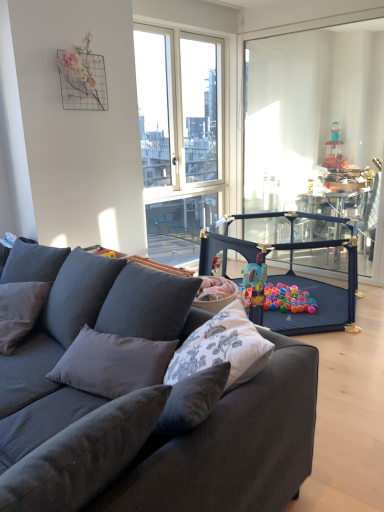
Question: Which is correct: dark gray fabric couch at center is inside transparent plastic playpen at right, or outside of it?

Choices:
 (A) inside
 (B) outside

Answer: (B)

Question: Is dark gray fabric couch at center bigger or smaller than transparent plastic playpen at right?

Choices:
 (A) small
 (B) big

Answer: (B)

Question: Which of these objects is positioned farthest from the dark gray fabric pillow at left?

Choices:
 (A) dark gray fabric playpen at center
 (B) dark gray fabric couch at center
 (C) transparent plastic playpen at right

Answer: (C)

Question: Which object is positioned farthest from the dark gray fabric couch at center?

Choices:
 (A) transparent plastic playpen at right
 (B) dark gray fabric playpen at center
 (C) dark gray fabric pillow at left

Answer: (A)